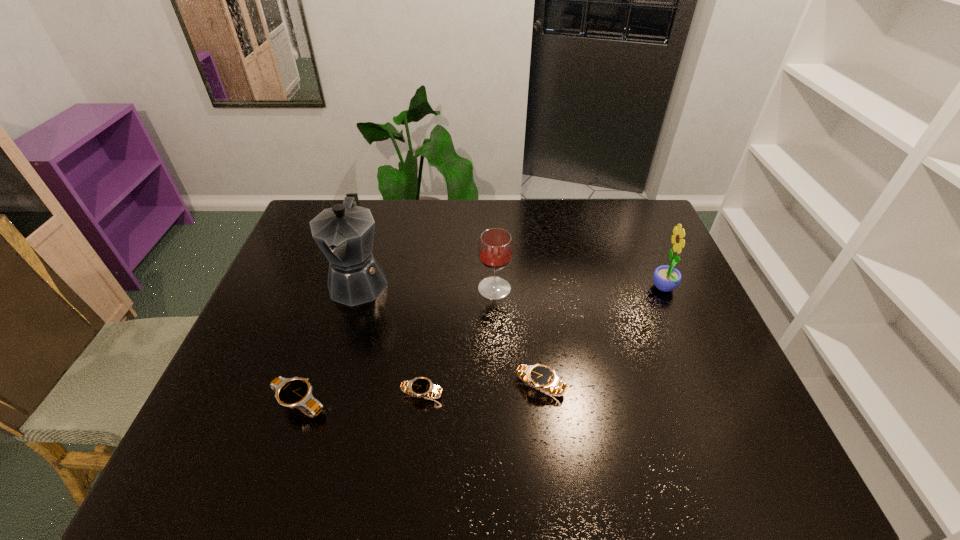
Where is `free space that is in between the second watch from left to right and the rightmost watch`? free space that is in between the second watch from left to right and the rightmost watch is located at coordinates (481, 390).

The width and height of the screenshot is (960, 540). I want to click on empty space between the tallest object and the wineglass, so click(x=426, y=285).

Locate which object is the fourth closest to the leftmost watch. Please provide its 2D coordinates. Your answer should be formatted as a tuple, i.e. [(x, y)], where the tuple contains the x and y coordinates of a point satisfying the conditions above.

[(495, 248)]

The image size is (960, 540). I want to click on object that is the closest to the fourth object from right to left, so click(295, 392).

Locate an element on the screen. watch that stands as the closest to the third object from left to right is located at coordinates [295, 392].

Locate an element on the screen. The image size is (960, 540). the closest watch to the shortest object is located at coordinates (295, 392).

Identify the location of free point that satisfies the following two spatial constraints: 1. at the spout of the shortest watch; 2. on the right side of the tallest object. (325, 395).

Find the location of a particular element. This screenshot has height=540, width=960. free spot that satisfies the following two spatial constraints: 1. at the spout of the tallest object; 2. on the left side of the third tallest object is located at coordinates (357, 288).

Find the location of `free space that satisfies the following two spatial constraints: 1. on the front-facing side of the rightmost object; 2. on the front side of the leftmost watch`. free space that satisfies the following two spatial constraints: 1. on the front-facing side of the rightmost object; 2. on the front side of the leftmost watch is located at coordinates (713, 404).

Where is `free space that satisfies the following two spatial constraints: 1. on the back side of the leftmost watch; 2. on the right side of the fourth object from right to left`? free space that satisfies the following two spatial constraints: 1. on the back side of the leftmost watch; 2. on the right side of the fourth object from right to left is located at coordinates (302, 395).